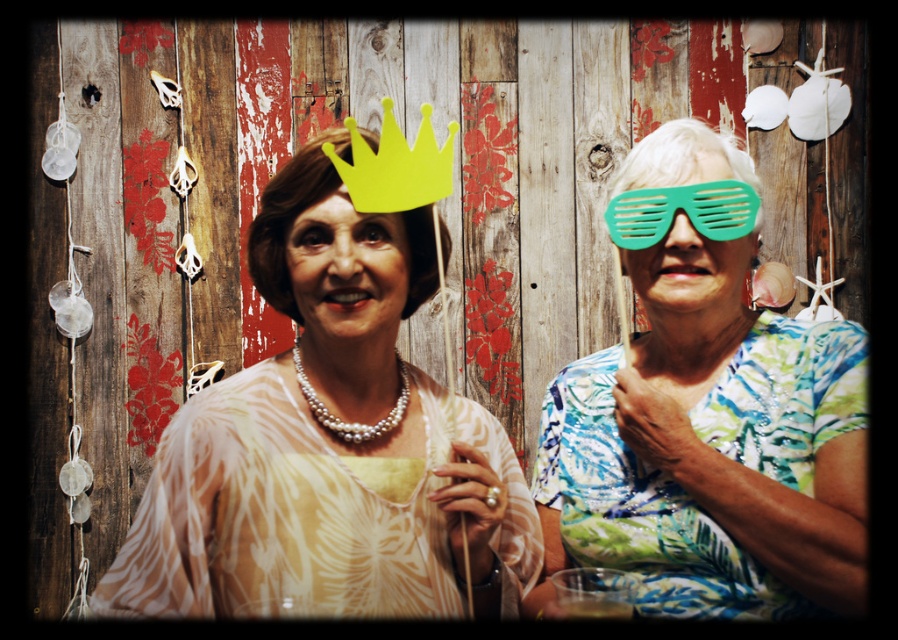
From the picture: Does green plastic glasses at right have a smaller size compared to green plastic goggles at right?

No, green plastic glasses at right is not smaller than green plastic goggles at right.

Can you confirm if green plastic glasses at right is bigger than green plastic goggles at right?

Yes, green plastic glasses at right is bigger than green plastic goggles at right.

What are the coordinates of `green plastic glasses at right` in the screenshot? It's located at (709, 417).

Consider the image. Between green plastic glasses at right and yellow paper crown at center, which one is positioned lower?

green plastic glasses at right is below.

Find the location of a particular element. green plastic glasses at right is located at coordinates (709, 417).

You are a GUI agent. You are given a task and a screenshot of the screen. Output one action in this format:
    pyautogui.click(x=<x>, y=<y>)
    Task: Click on the green plastic glasses at right
    
    Given the screenshot: What is the action you would take?
    pyautogui.click(x=709, y=417)

Between point (337, 577) and point (734, 188), which one is positioned behind?

Point (734, 188)

Does white sheer dress at center appear under green plastic goggles at right?

Indeed, white sheer dress at center is positioned under green plastic goggles at right.

What do you see at coordinates (279, 516) in the screenshot? I see `white sheer dress at center` at bounding box center [279, 516].

Identify the location of white sheer dress at center. The height and width of the screenshot is (640, 898). (279, 516).